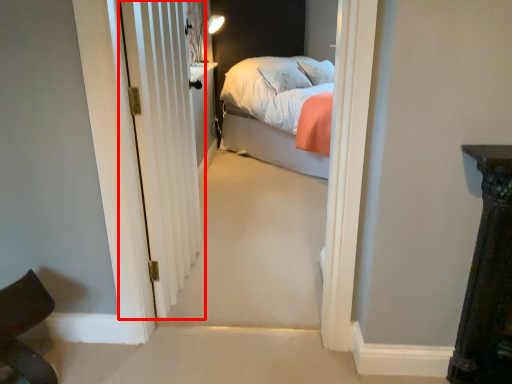
Question: In this image, where is door (annotated by the red box) located relative to chair?

Choices:
 (A) left
 (B) right

Answer: (B)